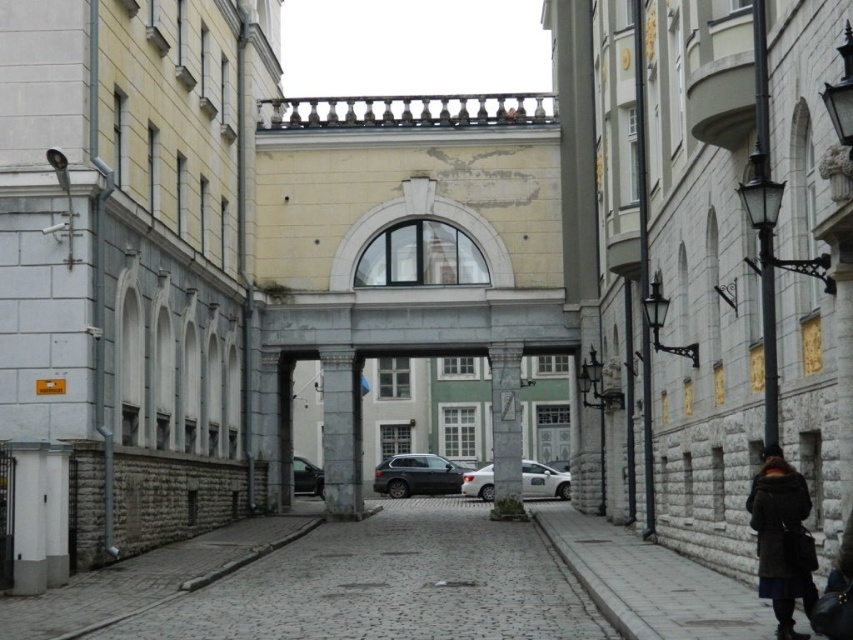
Is matte black suv at center smaller than white metallic car at center?

Correct, matte black suv at center occupies less space than white metallic car at center.

Is point (433, 493) farther from viewer compared to point (525, 465)?

Yes, point (433, 493) is behind point (525, 465).

Find the location of a particular element. matte black suv at center is located at coordinates (416, 476).

Which is more to the left, dark brown wool coat at lower right or matte black suv at center?

matte black suv at center

This screenshot has width=853, height=640. I want to click on dark brown wool coat at lower right, so click(780, 538).

This screenshot has width=853, height=640. I want to click on dark brown wool coat at lower right, so click(780, 538).

Does dark brown wool coat at lower right have a smaller size compared to shiny black car at center?

Correct, dark brown wool coat at lower right occupies less space than shiny black car at center.

This screenshot has height=640, width=853. Identify the location of dark brown wool coat at lower right. (780, 538).